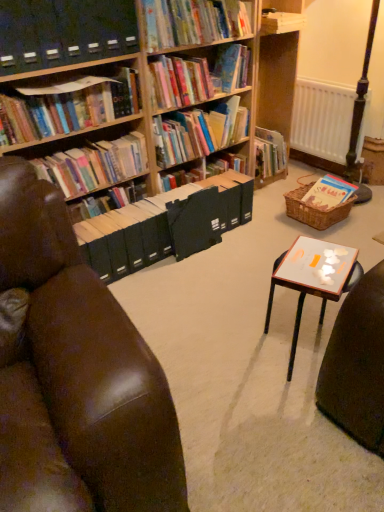
Question: Can you confirm if brown leather chair at left is thinner than hardcover books at left, arranged as the 5th book when viewed from the right?

Choices:
 (A) yes
 (B) no

Answer: (B)

Question: Considering the relative positions of brown leather chair at left and hardcover books at left, placed as the 2th book when sorted from left to right, in the image provided, is brown leather chair at left to the left of hardcover books at left, placed as the 2th book when sorted from left to right, from the viewer's perspective?

Choices:
 (A) yes
 (B) no

Answer: (B)

Question: Can we say brown leather chair at left lies outside hardcover books at left, arranged as the 5th book when viewed from the right?

Choices:
 (A) yes
 (B) no

Answer: (A)

Question: Is brown leather chair at left not close to hardcover books at left, placed as the 2th book when sorted from left to right?

Choices:
 (A) yes
 (B) no

Answer: (A)

Question: Does brown leather chair at left have a greater height compared to hardcover books at left, arranged as the 5th book when viewed from the right?

Choices:
 (A) no
 (B) yes

Answer: (B)

Question: In terms of size, does hardcover book at upper center, acting as the third book starting from the left, appear bigger or smaller than hardcover book at upper left, placed as the sixth book when sorted from right to left?

Choices:
 (A) small
 (B) big

Answer: (B)

Question: Based on their positions, is hardcover book at upper center, the 4th book positioned from the right, located to the left or right of hardcover book at upper left, which is counted as the 1th book, starting from the left?

Choices:
 (A) right
 (B) left

Answer: (A)

Question: Which is correct: hardcover book at upper center, the 4th book positioned from the right, is inside hardcover book at upper left, which is counted as the 1th book, starting from the left, or outside of it?

Choices:
 (A) inside
 (B) outside

Answer: (B)

Question: Does point (165, 10) appear closer or farther from the camera than point (56, 129)?

Choices:
 (A) closer
 (B) farther

Answer: (B)

Question: Is black plastic shelf at upper left to the left or to the right of white matte radiator at right in the image?

Choices:
 (A) right
 (B) left

Answer: (B)

Question: In terms of size, does black plastic shelf at upper left appear bigger or smaller than white matte radiator at right?

Choices:
 (A) big
 (B) small

Answer: (B)

Question: In terms of height, does black plastic shelf at upper left look taller or shorter compared to white matte radiator at right?

Choices:
 (A) tall
 (B) short

Answer: (B)

Question: Is black plastic shelf at upper left spatially inside white matte radiator at right, or outside of it?

Choices:
 (A) inside
 (B) outside

Answer: (B)

Question: In terms of size, does hardcover book at upper center, the 4th book positioned from the right, appear bigger or smaller than hardcover books at left, arranged as the 5th book when viewed from the right?

Choices:
 (A) big
 (B) small

Answer: (A)

Question: Is point (150, 31) positioned closer to the camera than point (127, 167)?

Choices:
 (A) closer
 (B) farther

Answer: (A)